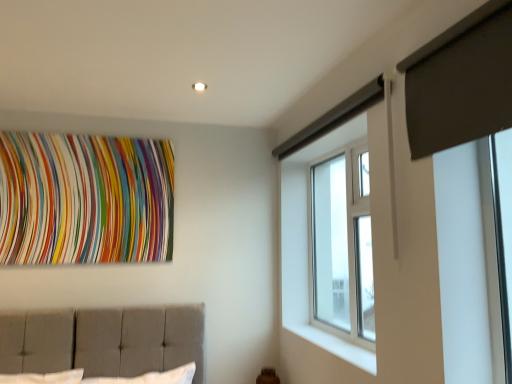
Question: Is dark gray fabric at upper right to the left or to the right of clear glass window at upper right in the image?

Choices:
 (A) right
 (B) left

Answer: (A)

Question: Considering the positions of dark gray fabric at upper right and clear glass window at upper right in the image, is dark gray fabric at upper right taller or shorter than clear glass window at upper right?

Choices:
 (A) tall
 (B) short

Answer: (B)

Question: Which object is the closest to the clear glass window at upper right?

Choices:
 (A) dark gray fabric at upper right
 (B) white smooth window sill at lower right
 (C) multicolored fabric at upper left

Answer: (B)

Question: Which object is the closest to the clear glass window at upper right?

Choices:
 (A) dark gray fabric at upper right
 (B) white smooth window sill at lower right
 (C) multicolored fabric at upper left

Answer: (B)